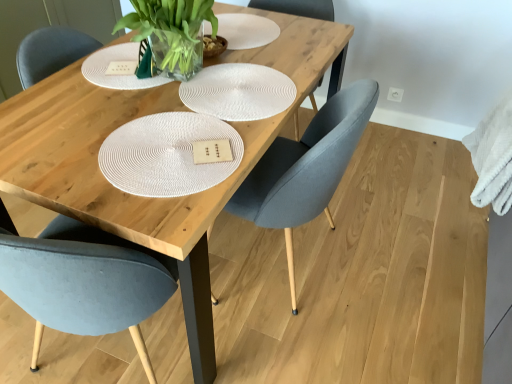
The image size is (512, 384). In order to click on free space behind white woven placemat at center in this screenshot , I will do `click(287, 53)`.